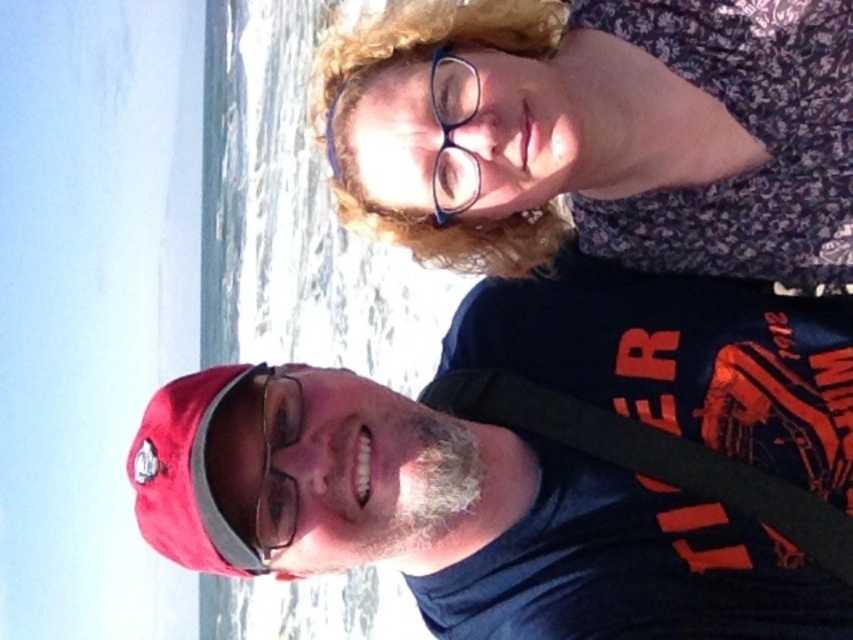
Question: Does floral fabric dress at upper right appear under blue plastic glasses at upper center?

Choices:
 (A) no
 (B) yes

Answer: (A)

Question: Which of the following is the closest to the observer?

Choices:
 (A) curly blonde hair at upper center
 (B) black fabric strap at lower center
 (C) blue plastic glasses at upper center
 (D) floral fabric dress at upper right

Answer: (B)

Question: Based on their relative distances, which object is farther from the floral fabric dress at upper right?

Choices:
 (A) blue plastic glasses at upper center
 (B) red cap at lower left

Answer: (B)

Question: Does floral fabric dress at upper right appear under curly blonde hair at upper center?

Choices:
 (A) yes
 (B) no

Answer: (A)

Question: Which object is the farthest from the blue plastic glasses at upper center?

Choices:
 (A) clear plastic glasses at center
 (B) gray fuzzy beard at lower center

Answer: (A)

Question: Is the position of black fabric strap at lower center less distant than that of gray fuzzy beard at lower center?

Choices:
 (A) yes
 (B) no

Answer: (A)